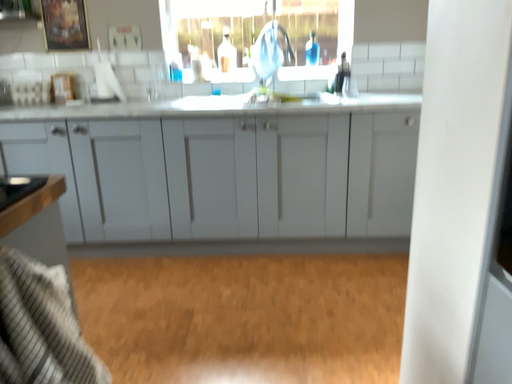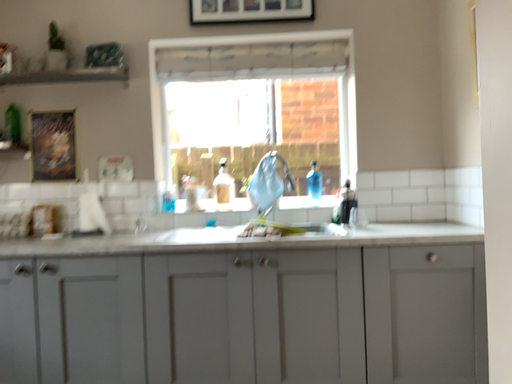
Question: How did the camera likely rotate when shooting the video?

Choices:
 (A) rotated downward
 (B) rotated upward

Answer: (B)